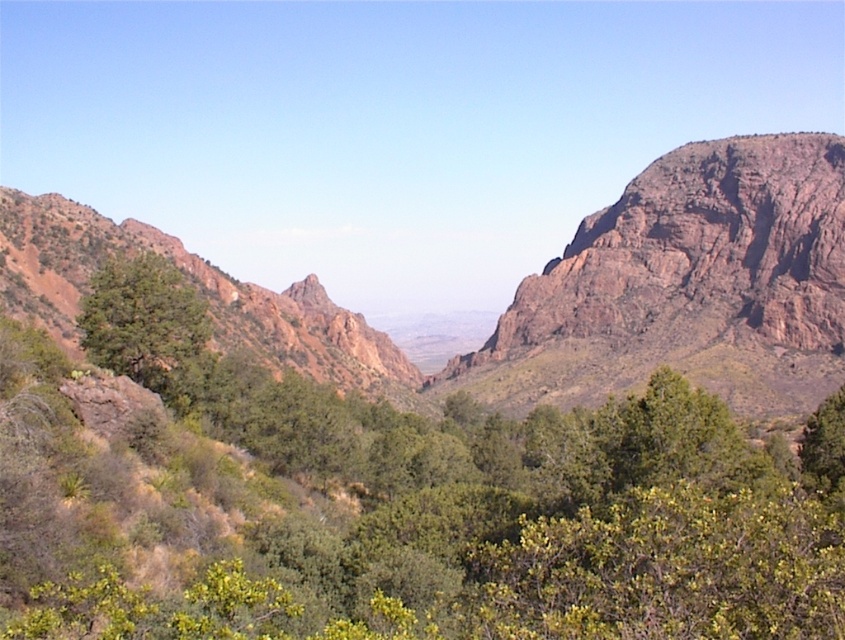
Is point (15, 220) farther from camera compared to point (830, 397)?

That is True.

Is rustic rock formation at left wider than green leafy tree at center?

Yes, rustic rock formation at left is wider than green leafy tree at center.

Locate an element on the screen. rustic rock formation at left is located at coordinates (199, 288).

This screenshot has width=845, height=640. In order to click on rustic rock formation at left in this screenshot , I will do `click(199, 288)`.

Between rustic rock mountain at center and green leafy tree at left, which one is positioned lower?

green leafy tree at left is below.

Is rustic rock mountain at center to the left of green leafy tree at left from the viewer's perspective?

In fact, rustic rock mountain at center is to the right of green leafy tree at left.

Is point (473, 353) in front of point (148, 365)?

No, it is behind (148, 365).

The height and width of the screenshot is (640, 845). I want to click on rustic rock mountain at center, so click(x=544, y=289).

Does rustic rock mountain at center come behind rusty rock mountain at right?

No, rustic rock mountain at center is closer to the viewer.

Looking at this image, is rustic rock mountain at center closer to the viewer compared to rusty rock mountain at right?

Yes.

Image resolution: width=845 pixels, height=640 pixels. Identify the location of rustic rock mountain at center. (544, 289).

Image resolution: width=845 pixels, height=640 pixels. Identify the location of rustic rock mountain at center. (544, 289).